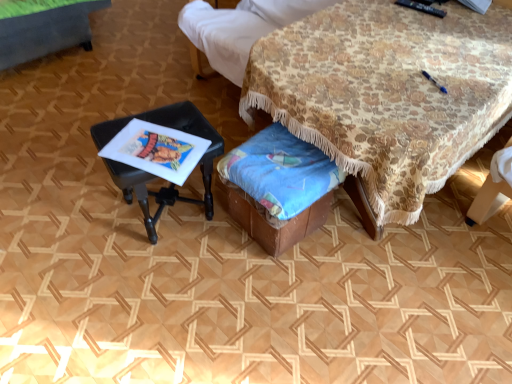
You are a GUI agent. You are given a task and a screenshot of the screen. Output one action in this format:
    pyautogui.click(x=<x>, y=<y>)
    Task: Click on the free space to the left of blue fabric at lower center
    Image resolution: width=512 pixels, height=384 pixels.
    Given the screenshot: What is the action you would take?
    pyautogui.click(x=200, y=256)